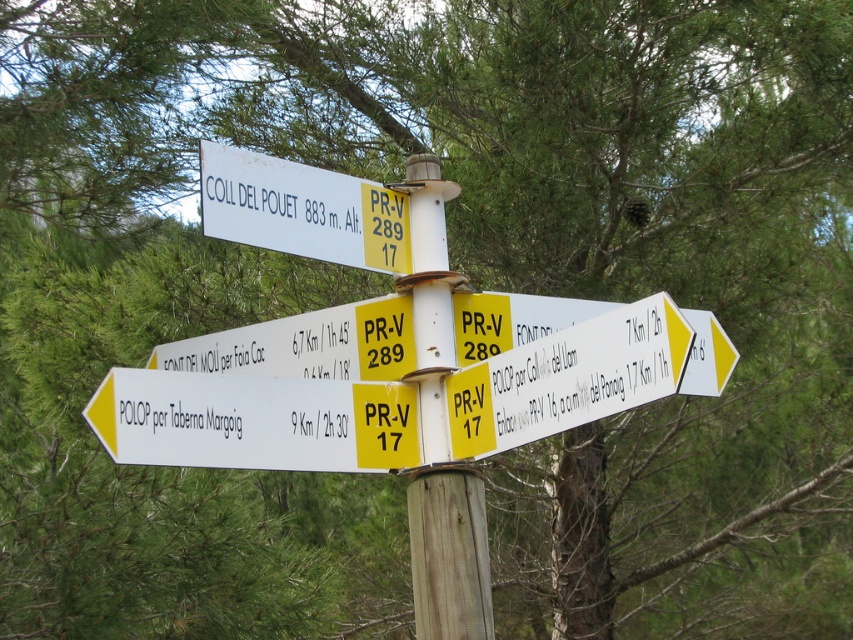
Question: Is white wooden post at center positioned before white plastic sign at upper center?

Choices:
 (A) no
 (B) yes

Answer: (A)

Question: Which of the following is the closest to the observer?

Choices:
 (A) (187, 413)
 (B) (448, 618)
 (C) (624, 408)

Answer: (C)

Question: Based on their relative distances, which object is nearer to the white plastic sign at lower left?

Choices:
 (A) white plastic sign at upper center
 (B) yellow plastic sign at center

Answer: (A)

Question: Which object is positioned farthest from the white plastic sign at lower left?

Choices:
 (A) white wooden post at center
 (B) white plastic sign at upper center
 (C) yellow plastic sign at center

Answer: (C)

Question: Is white plastic sign at lower left positioned in front of white wooden post at center?

Choices:
 (A) yes
 (B) no

Answer: (A)

Question: Is white plastic sign at lower left above white wooden post at center?

Choices:
 (A) yes
 (B) no

Answer: (B)